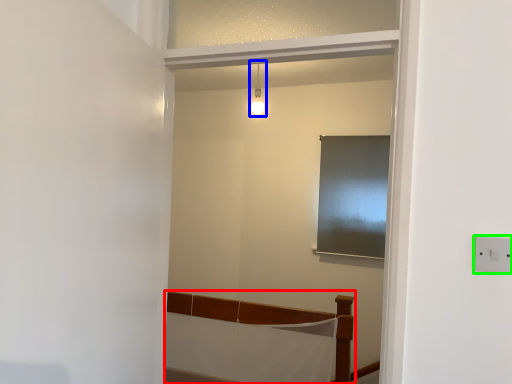
Question: Which is farther away from furniture (highlighted by a red box)? light fixture (highlighted by a blue box) or electric outlet (highlighted by a green box)?

Choices:
 (A) light fixture
 (B) electric outlet

Answer: (B)